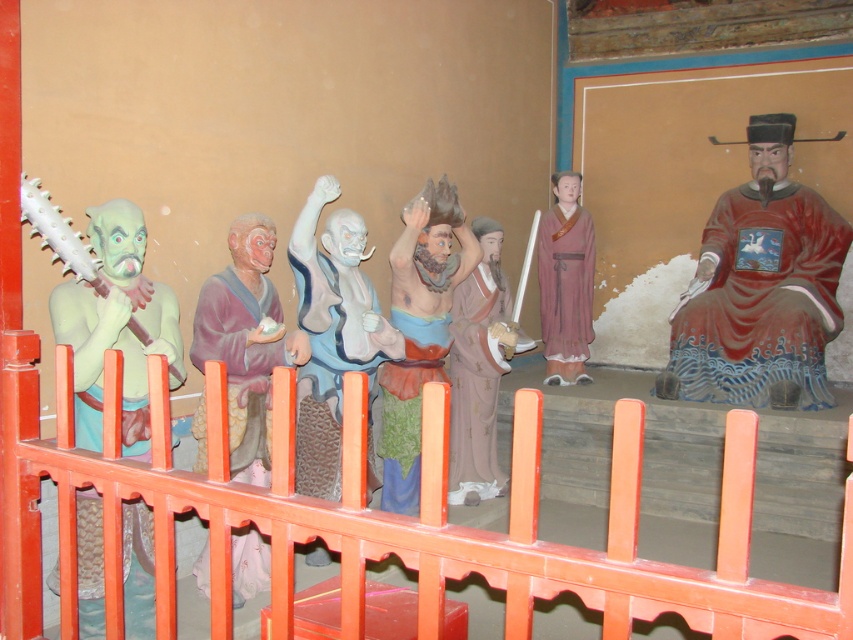
Which is above, red glossy robe at right or matte clay figure at center?

red glossy robe at right

Locate an element on the screen. red glossy robe at right is located at coordinates (761, 298).

Does green painted wood figure at left have a smaller size compared to green fabric robe at center?

No, green painted wood figure at left is not smaller than green fabric robe at center.

Is green painted wood figure at left shorter than green fabric robe at center?

No, green painted wood figure at left is not shorter than green fabric robe at center.

Is point (148, 593) positioned after point (396, 451)?

No, it is in front of (396, 451).

At what (x,y) coordinates should I click in order to perform the action: click on green painted wood figure at left. Please return your answer as a coordinate pair (x, y). The width and height of the screenshot is (853, 640). Looking at the image, I should click on (115, 326).

Which is more to the left, orange painted wood rail at center or green fabric robe at center?

orange painted wood rail at center is more to the left.

Which is below, orange painted wood rail at center or green fabric robe at center?

green fabric robe at center is lower down.

Where is `orange painted wood rail at center`? orange painted wood rail at center is located at coordinates (381, 518).